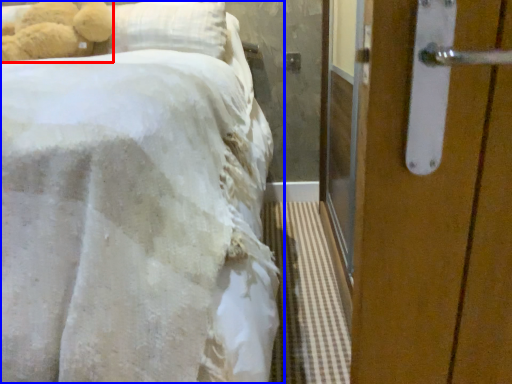
Question: Which object is closer to the camera taking this photo, teddy bear (highlighted by a red box) or bed (highlighted by a blue box)?

Choices:
 (A) teddy bear
 (B) bed

Answer: (B)